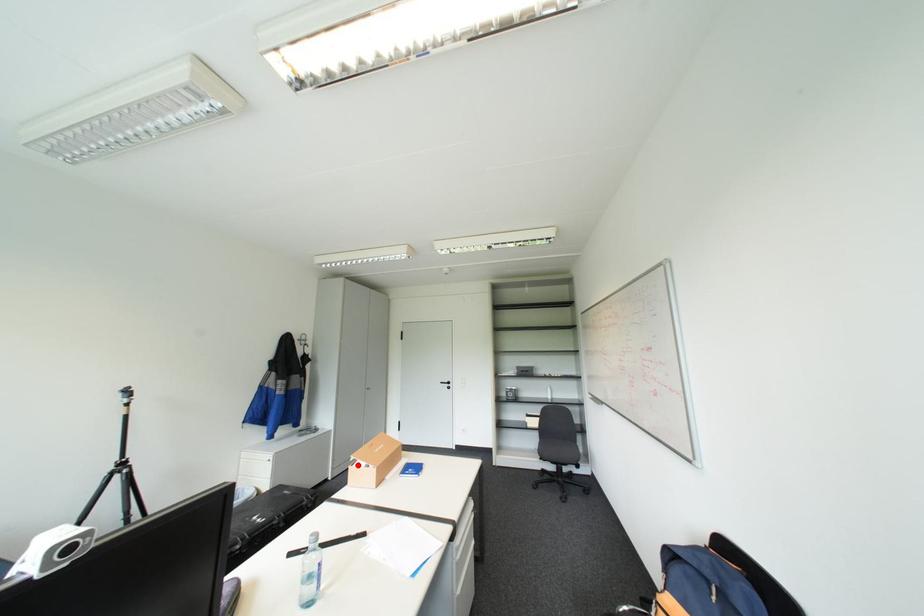
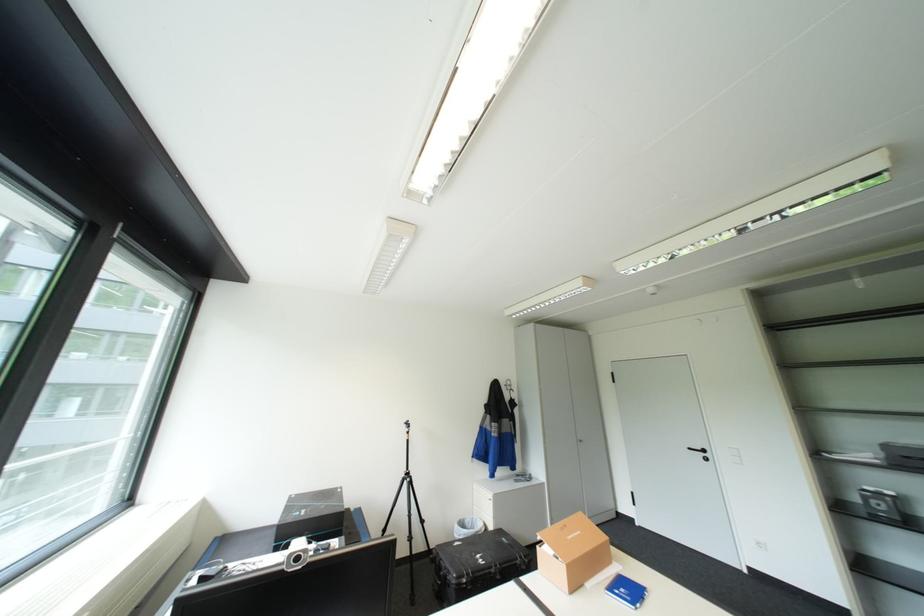
Find the pixel in the second image that matches the highlighted location in the first image.

(545, 545)